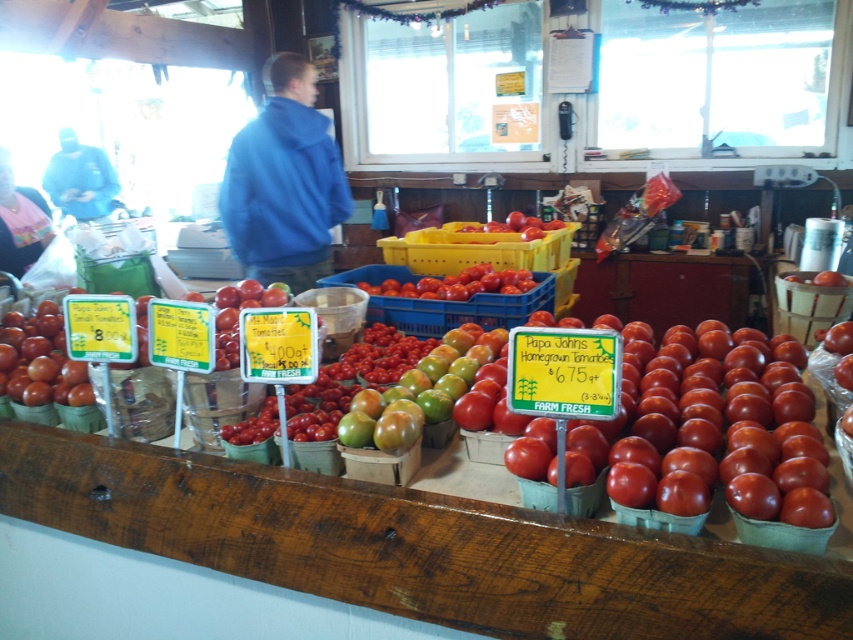
You are a customer at the produce stand. You want to know if the matte blue hoodie at left is taller than the shiny red tomatoes at center. Can you confirm this?

The matte blue hoodie at left has a greater height compared to the shiny red tomatoes at center, so yes, the matte blue hoodie at left is taller than the shiny red tomatoes at center.

You are a customer at the market and need to choose between wearing your blue fleece jacket at center and matte blue hoodie at left. Which one is wider?

The matte blue hoodie at left is wider than the blue fleece jacket at center.